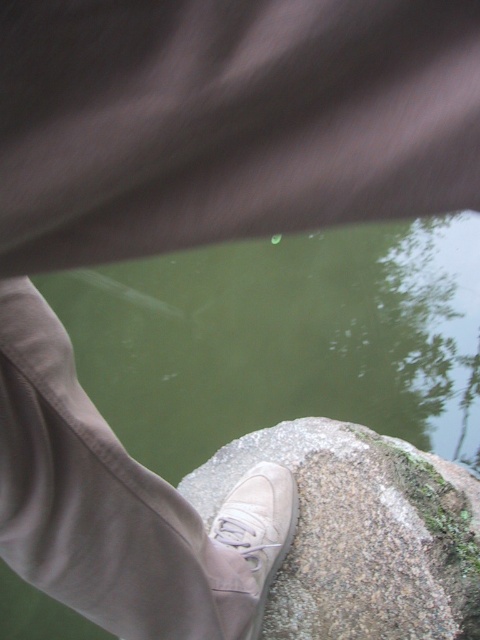
Question: Does gray rough rock at center have a smaller size compared to suede/leather shoe at center?

Choices:
 (A) yes
 (B) no

Answer: (B)

Question: Does green water at center have a larger size compared to suede/leather shoe at center?

Choices:
 (A) yes
 (B) no

Answer: (A)

Question: Considering the real-world distances, which object is farthest from the gray rough rock at center?

Choices:
 (A) suede/leather shoe at center
 (B) green water at center

Answer: (B)

Question: Among these points, which one is nearest to the camera?

Choices:
 (A) pos(348,492)
 (B) pos(208,252)

Answer: (A)

Question: Is green water at center to the left of gray rough rock at center from the viewer's perspective?

Choices:
 (A) yes
 (B) no

Answer: (B)

Question: Which object is farther from the camera taking this photo?

Choices:
 (A) gray rough rock at center
 (B) green water at center

Answer: (B)